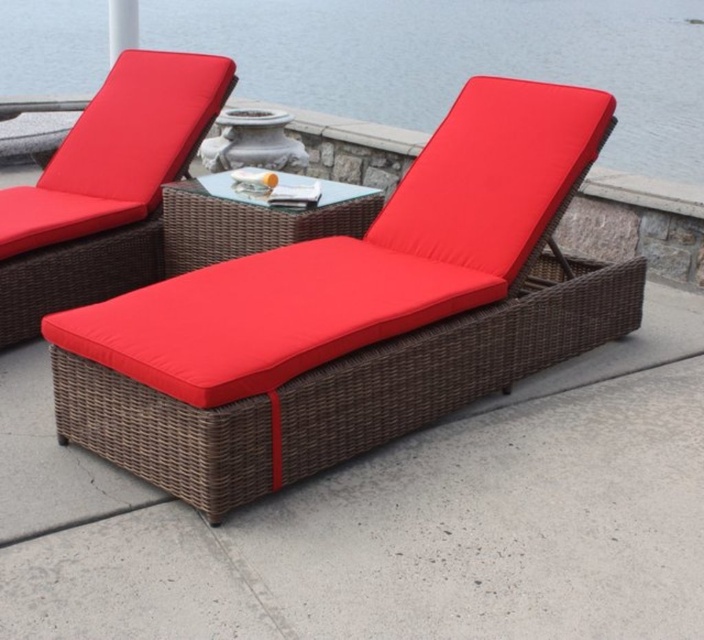
Consider the image. Can you confirm if brown wicker chaise lounge at center is bigger than matte wicker chaise at upper left?

Correct, brown wicker chaise lounge at center is larger in size than matte wicker chaise at upper left.

Which is in front, point (56, 356) or point (81, 134)?

Positioned in front is point (56, 356).

Identify the location of brown wicker chaise lounge at center. This screenshot has height=640, width=704. [351, 316].

In the scene shown: Is the position of transparent glass water at upper center less distant than that of matte wicker chaise at upper left?

No.

Does transparent glass water at upper center have a lesser width compared to matte wicker chaise at upper left?

Incorrect, transparent glass water at upper center's width is not less than matte wicker chaise at upper left's.

Which is in front, point (413, 86) or point (118, 230)?

Point (118, 230) is in front.

The width and height of the screenshot is (704, 640). Identify the location of transparent glass water at upper center. (460, 60).

Can you confirm if brown wicker chaise lounge at center is taller than transparent glass water at upper center?

Correct, brown wicker chaise lounge at center is much taller as transparent glass water at upper center.

Identify the location of brown wicker chaise lounge at center. (351, 316).